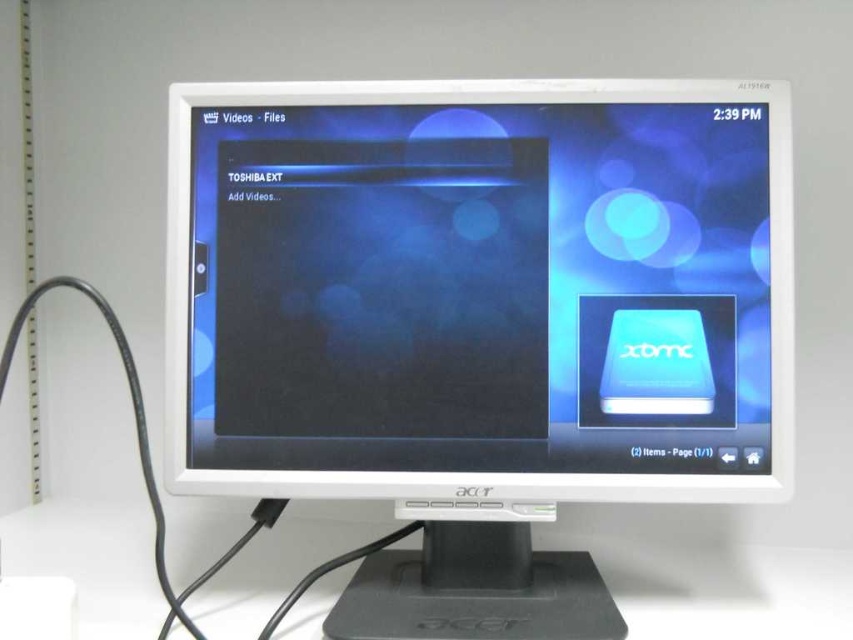
Question: Is white plastic monitor at center thinner than white plastic computer desk at center?

Choices:
 (A) yes
 (B) no

Answer: (A)

Question: Among these objects, which one is nearest to the camera?

Choices:
 (A) white plastic monitor at center
 (B) white plastic computer desk at center

Answer: (B)

Question: From the image, what is the correct spatial relationship of white plastic monitor at center in relation to white plastic computer desk at center?

Choices:
 (A) right
 (B) left

Answer: (A)

Question: Which point is farther to the camera?

Choices:
 (A) white plastic monitor at center
 (B) white plastic computer desk at center

Answer: (A)

Question: Is white plastic monitor at center thinner than white plastic computer desk at center?

Choices:
 (A) yes
 (B) no

Answer: (A)